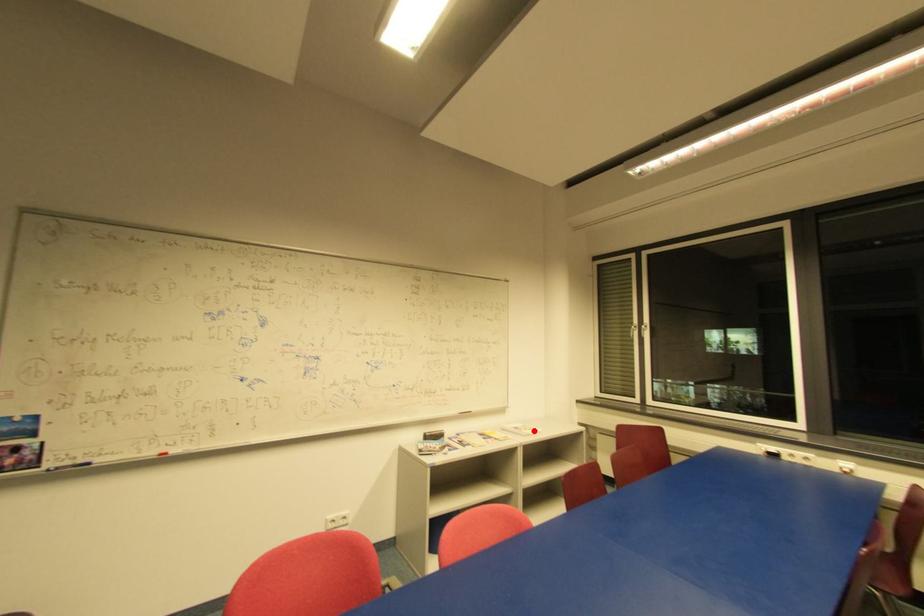
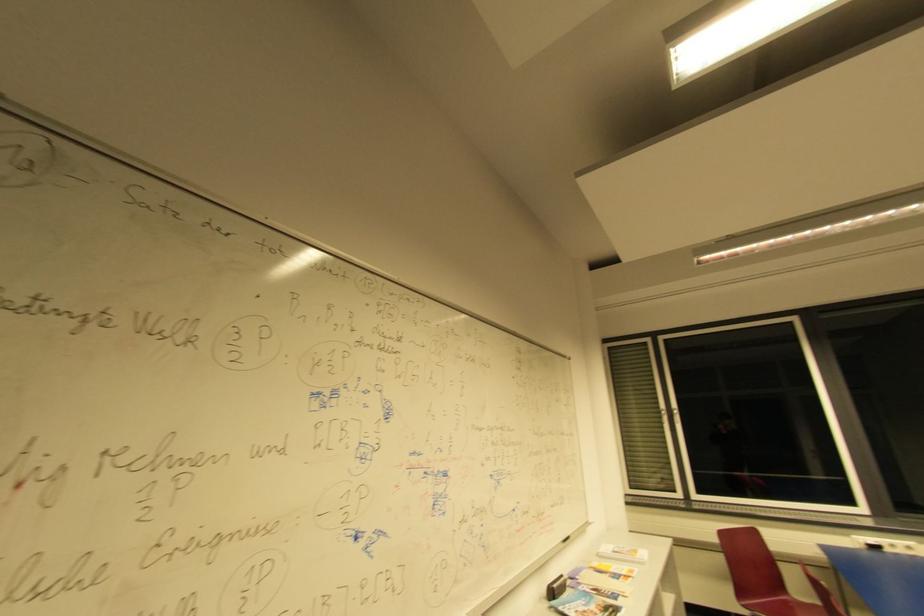
Where in the second image is the point corresponding to the highlighted location from the first image?

(640, 553)